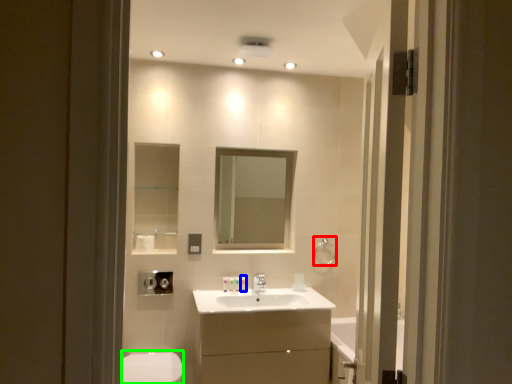
Question: Estimate the real-world distances between objects in this image. Which object is farther from towel bar (highlighted by a red box), toiletry (highlighted by a blue box) or toilet bowl (highlighted by a green box)?

Choices:
 (A) toiletry
 (B) toilet bowl

Answer: (B)